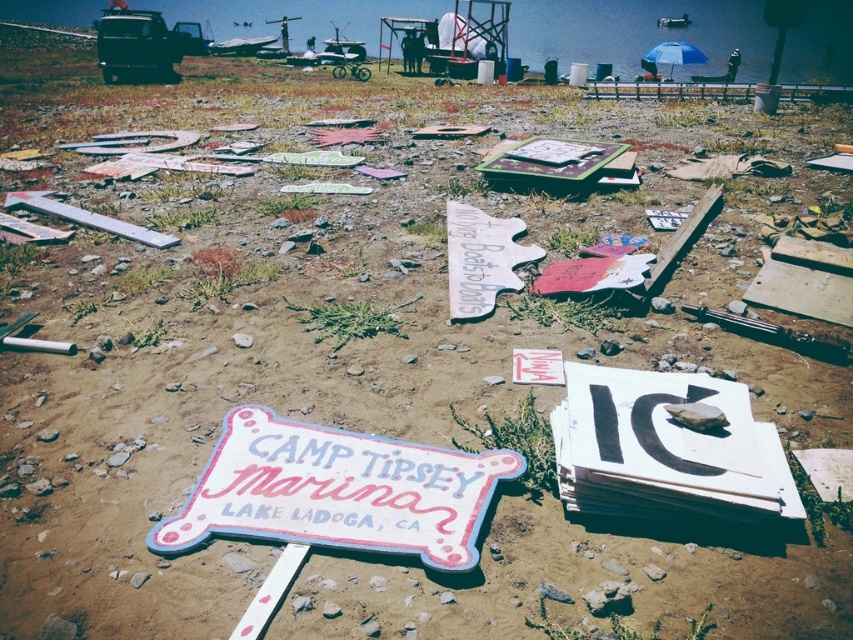
You are standing in the outdoor scene looking at the two signs. Which sign is nearer to you, the pastel painted wooden sign at center or the white painted wood sign at center?

The pastel painted wooden sign at center is closer to the viewer than the white painted wood sign at center.